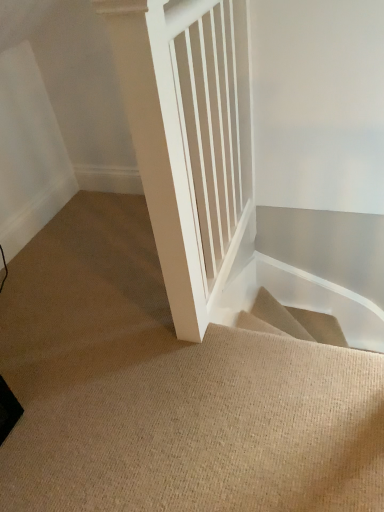
Question: Can you confirm if white smooth wooden pillar at center is shorter than beige carpeted stairs at center?

Choices:
 (A) yes
 (B) no

Answer: (B)

Question: Does white smooth wooden pillar at center contain beige carpeted stairs at center?

Choices:
 (A) no
 (B) yes

Answer: (A)

Question: Does white smooth wooden pillar at center lie behind beige carpeted stairs at center?

Choices:
 (A) no
 (B) yes

Answer: (A)

Question: Is white smooth wooden pillar at center oriented away from beige carpeted stairs at center?

Choices:
 (A) no
 (B) yes

Answer: (B)

Question: Would you say white smooth wooden pillar at center is a long distance from beige carpeted stairs at center?

Choices:
 (A) yes
 (B) no

Answer: (B)

Question: Can you confirm if white smooth wooden pillar at center is taller than beige carpeted stairs at center?

Choices:
 (A) yes
 (B) no

Answer: (A)

Question: Is beige carpeted stairs at center at the right side of white smooth wooden pillar at center?

Choices:
 (A) yes
 (B) no

Answer: (B)

Question: Does beige carpeted stairs at center have a lesser height compared to white smooth wooden pillar at center?

Choices:
 (A) yes
 (B) no

Answer: (A)

Question: From the image's perspective, does beige carpeted stairs at center appear lower than white smooth wooden pillar at center?

Choices:
 (A) no
 (B) yes

Answer: (B)

Question: Could you tell me if beige carpeted stairs at center is turned towards white smooth wooden pillar at center?

Choices:
 (A) no
 (B) yes

Answer: (A)

Question: Is beige carpeted stairs at center not inside white smooth wooden pillar at center?

Choices:
 (A) yes
 (B) no

Answer: (A)

Question: From a real-world perspective, is beige carpeted stairs at center positioned over white smooth wooden pillar at center based on gravity?

Choices:
 (A) yes
 (B) no

Answer: (B)

Question: From the image's perspective, relative to white smooth wooden pillar at center, is beige carpeted stairs at center above or below?

Choices:
 (A) below
 (B) above

Answer: (A)